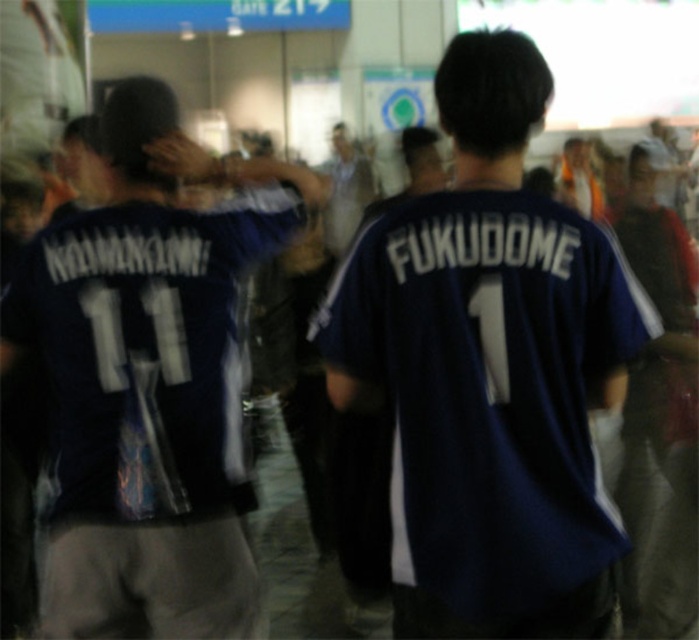
Question: Can you confirm if dark blue jersey at center is wider than matte blue jersey at center?

Choices:
 (A) no
 (B) yes

Answer: (A)

Question: From the image, what is the correct spatial relationship of matte blue jersey at center in relation to blue jersey at center?

Choices:
 (A) left
 (B) right

Answer: (A)

Question: Considering the relative positions of dark blue jersey at center and blue jersey at center in the image provided, where is dark blue jersey at center located with respect to blue jersey at center?

Choices:
 (A) right
 (B) left

Answer: (A)

Question: Which of the following is the farthest from the observer?

Choices:
 (A) (360, 198)
 (B) (438, 204)
 (C) (203, 273)

Answer: (A)

Question: Which object appears closest to the camera in this image?

Choices:
 (A) dark blue jersey at center
 (B) matte blue jersey at center

Answer: (A)

Question: Which object is farther from the camera taking this photo?

Choices:
 (A) matte blue jersey at center
 (B) blue jersey at center
 (C) dark blue jersey at center

Answer: (B)